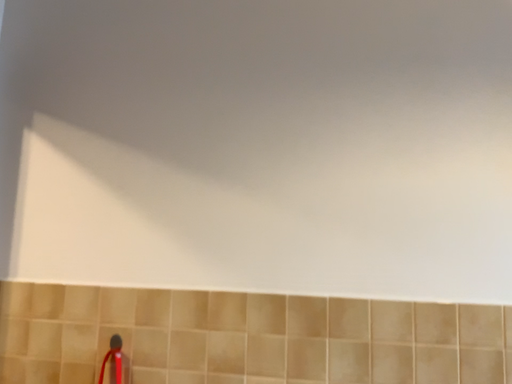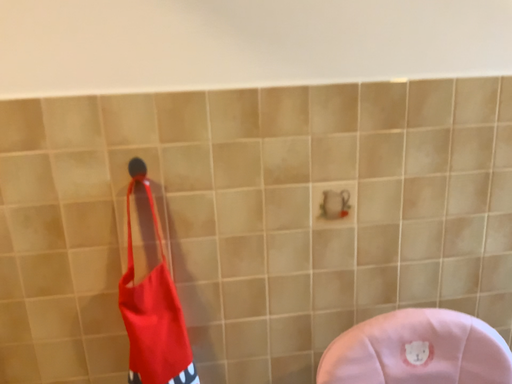
Question: How did the camera likely rotate when shooting the video?

Choices:
 (A) rotated upward
 (B) rotated downward

Answer: (B)